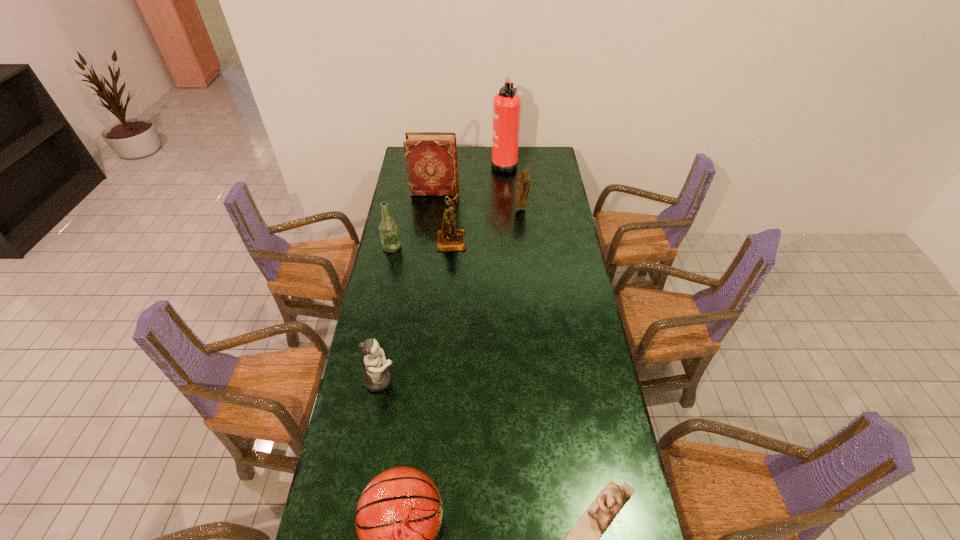
This screenshot has width=960, height=540. In order to click on vacant region located 0.350m at the nozzle of the farthest object in this screenshot , I will do `click(428, 164)`.

Find the location of a particular element. This screenshot has height=540, width=960. blank space located 0.400m at the nozzle of the farthest object is located at coordinates (420, 164).

This screenshot has width=960, height=540. I want to click on free spot located on the spine side of the second farthest object, so click(x=492, y=192).

Locate an element on the screen. This screenshot has width=960, height=540. vacant region located on the front-facing side of the second figurine from left to right is located at coordinates (511, 240).

Find the location of `vacant space located on the surface of the beer bottle`. vacant space located on the surface of the beer bottle is located at coordinates (479, 247).

Identify the location of blank space located 0.160m on the front-facing side of the sixth nearest object. The width and height of the screenshot is (960, 540). (524, 232).

This screenshot has width=960, height=540. I want to click on free space located on the front-facing side of the sixth farthest object, so click(x=467, y=380).

The image size is (960, 540). What are the coordinates of `object at the far edge` in the screenshot? It's located at pos(506,104).

Find the location of `hardback book that is at the left edge`. hardback book that is at the left edge is located at coordinates (431, 157).

Find the location of a particular element. The height and width of the screenshot is (540, 960). beer bottle at the left edge is located at coordinates (388, 229).